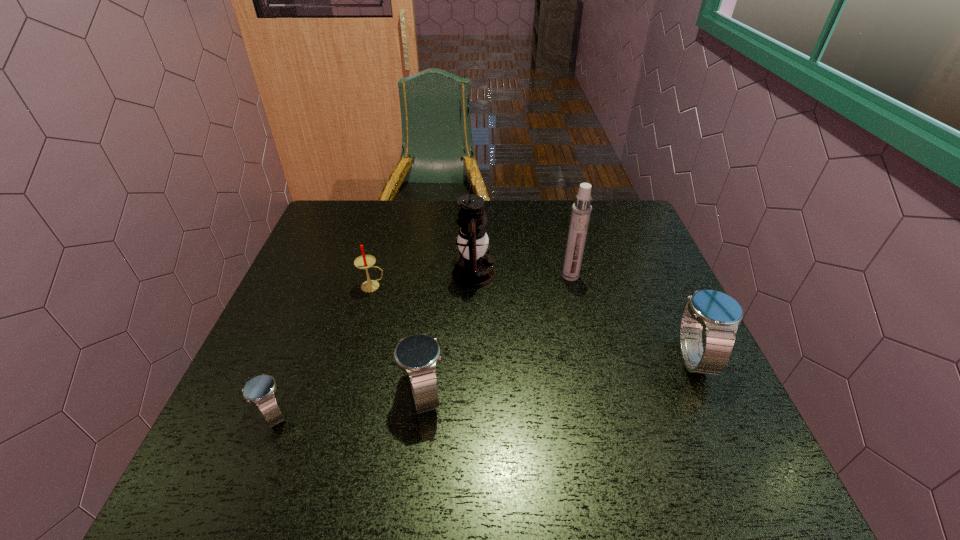
Locate an element on the screen. This screenshot has width=960, height=540. vacant space located on the back of the second object from right to left is located at coordinates [557, 217].

Where is `free point located 0.280m on the right of the fifth object from right to left`? The image size is (960, 540). free point located 0.280m on the right of the fifth object from right to left is located at coordinates (490, 286).

Locate an element on the screen. vacant space located 0.370m on the side of the lantern, there is a wick adjustment knob is located at coordinates (629, 274).

Identify the location of object present at the left edge. Image resolution: width=960 pixels, height=540 pixels. (260, 390).

Identify the location of object present at the right edge. (719, 314).

The width and height of the screenshot is (960, 540). In order to click on object that is positioned at the near left corner in this screenshot , I will do `click(260, 390)`.

The width and height of the screenshot is (960, 540). Identify the location of free space at the far edge. (526, 226).

This screenshot has height=540, width=960. In order to click on free space at the near edge of the desktop in this screenshot , I will do `click(395, 409)`.

In the image, there is a desktop. Identify the location of vacant space at the left edge. (324, 326).

Where is `free location at the right edge of the desktop`? The height and width of the screenshot is (540, 960). free location at the right edge of the desktop is located at coordinates pos(657,399).